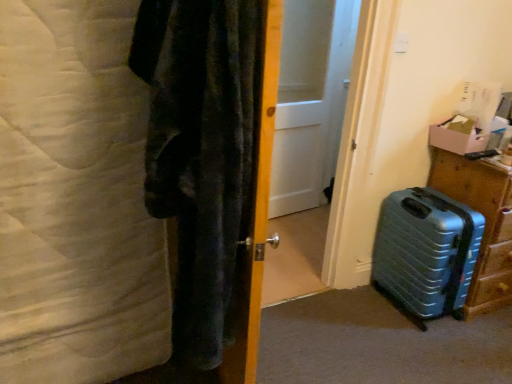
Identify the location of free space between wooden door at center and metallic blue suitcase at lower right. (341, 333).